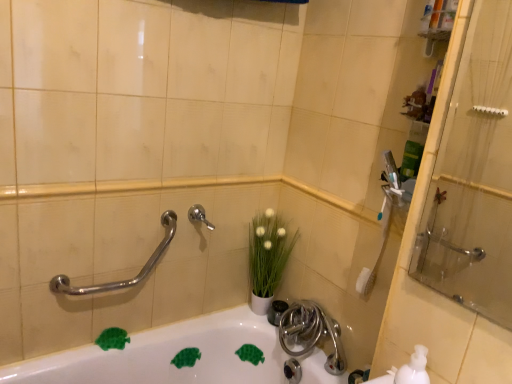
Question: From the image's perspective, is satin nickel faucet at lower center below transparent glass shower door at right?

Choices:
 (A) no
 (B) yes

Answer: (B)

Question: Is satin nickel faucet at lower center looking in the opposite direction of transparent glass shower door at right?

Choices:
 (A) yes
 (B) no

Answer: (B)

Question: Can you confirm if satin nickel faucet at lower center is positioned to the left of transparent glass shower door at right?

Choices:
 (A) no
 (B) yes

Answer: (B)

Question: Is satin nickel faucet at lower center behind transparent glass shower door at right?

Choices:
 (A) yes
 (B) no

Answer: (A)

Question: Can you confirm if satin nickel faucet at lower center is wider than transparent glass shower door at right?

Choices:
 (A) no
 (B) yes

Answer: (B)

Question: Is satin nickel faucet at lower center not inside transparent glass shower door at right?

Choices:
 (A) yes
 (B) no

Answer: (A)

Question: Is satin nickel faucet at center wider than white matte soap dispenser at lower right?

Choices:
 (A) no
 (B) yes

Answer: (B)

Question: Is white matte soap dispenser at lower right completely or partially inside satin nickel faucet at center?

Choices:
 (A) yes
 (B) no

Answer: (B)

Question: Considering the relative sizes of satin nickel faucet at center and white matte soap dispenser at lower right in the image provided, is satin nickel faucet at center shorter than white matte soap dispenser at lower right?

Choices:
 (A) yes
 (B) no

Answer: (A)

Question: Is satin nickel faucet at center bigger than white matte soap dispenser at lower right?

Choices:
 (A) no
 (B) yes

Answer: (A)

Question: Is satin nickel faucet at center to the right of white matte soap dispenser at lower right from the viewer's perspective?

Choices:
 (A) no
 (B) yes

Answer: (A)

Question: Is satin nickel faucet at center thinner than white matte soap dispenser at lower right?

Choices:
 (A) yes
 (B) no

Answer: (B)

Question: Considering the relative sizes of polished chrome grab bar at upper left and satin nickel faucet at center in the image provided, is polished chrome grab bar at upper left taller than satin nickel faucet at center?

Choices:
 (A) yes
 (B) no

Answer: (A)